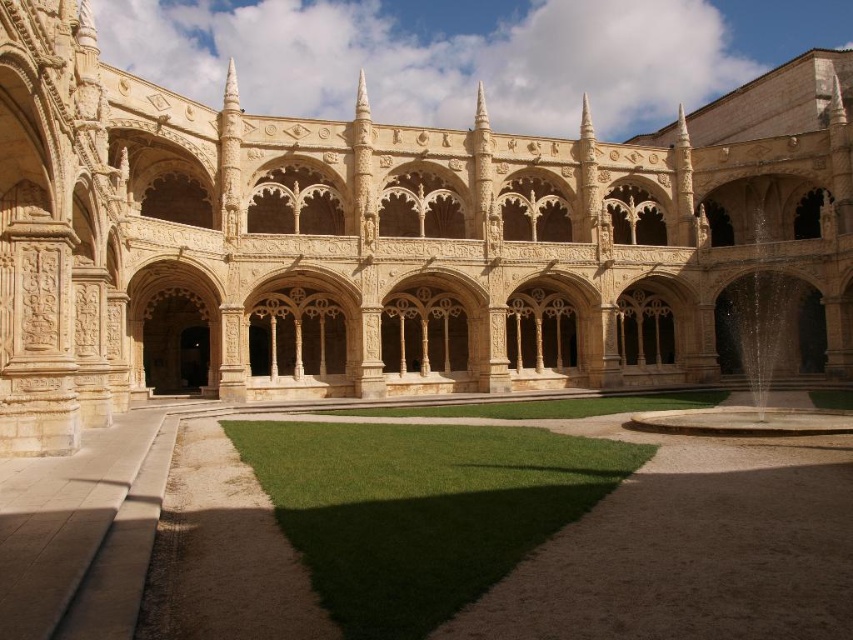
You are standing in the courtyard and want to walk from the green grass at center to the beige stone arches at center. Which direction should you head?

The beige stone arches at center are to the right of the green grass at center, so you should head to the right to reach them.

In the scene shown: You are standing in the courtyard of a historic building. There is a point marked at coordinates (381, 240). What is located at this point?

The beige stone arches at center are located at point (381, 240).

You are standing in the courtyard and want to walk towards the fountain located at the far end. Which object, the beige stone arches at center or the green grass at center, will you pass first?

You will pass the beige stone arches at center first because the green grass at center is behind them, so the arches are closer to your starting position.